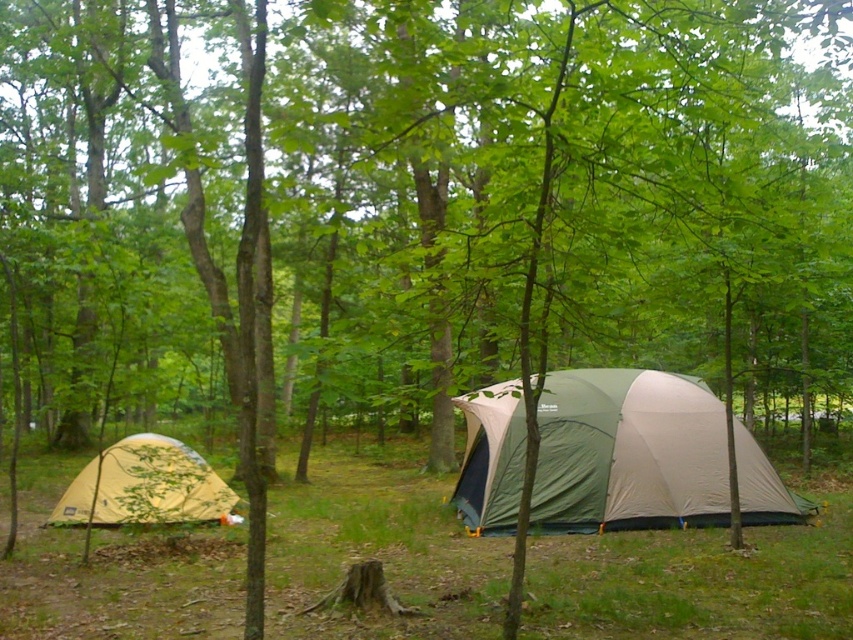
Question: Can you confirm if green fabric tent at center is positioned above yellow fabric tent at lower left?

Choices:
 (A) no
 (B) yes

Answer: (B)

Question: Among these points, which one is nearest to the camera?

Choices:
 (A) (206, 502)
 (B) (599, 451)

Answer: (A)

Question: Which point is farther from the camera taking this photo?

Choices:
 (A) (624, 440)
 (B) (178, 497)

Answer: (A)

Question: Does green fabric tent at center appear on the left side of yellow fabric tent at lower left?

Choices:
 (A) no
 (B) yes

Answer: (A)

Question: Among these points, which one is farthest from the camera?

Choices:
 (A) pos(497,488)
 (B) pos(123,461)

Answer: (A)

Question: Does green fabric tent at center appear over yellow fabric tent at lower left?

Choices:
 (A) yes
 (B) no

Answer: (A)